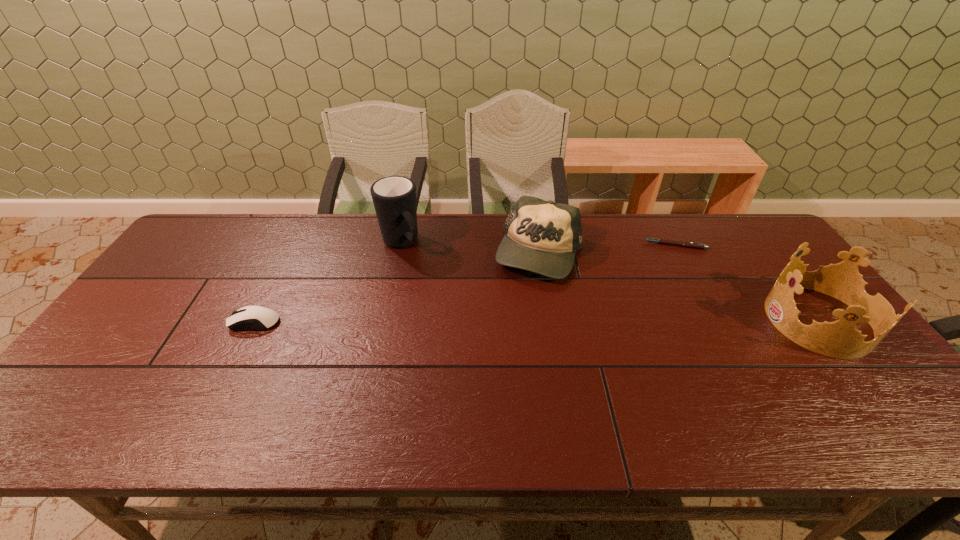
In order to click on free space located 0.300m on the front-facing side of the rightmost object in this screenshot , I will do `click(658, 320)`.

You are a GUI agent. You are given a task and a screenshot of the screen. Output one action in this format:
    pyautogui.click(x=<x>, y=<y>)
    Task: Click on the vacant region located 0.080m on the front-facing side of the rightmost object
    The image size is (960, 540).
    Given the screenshot: What is the action you would take?
    pyautogui.click(x=740, y=320)

Where is `free space located at the nib of the fourth object from left to right`? The height and width of the screenshot is (540, 960). free space located at the nib of the fourth object from left to right is located at coordinates (607, 290).

The width and height of the screenshot is (960, 540). Find the location of `free space located at the nib of the fourth object from left to right`. free space located at the nib of the fourth object from left to right is located at coordinates (631, 269).

Where is `free space located 0.280m at the nib of the fourth object from left to right`? This screenshot has width=960, height=540. free space located 0.280m at the nib of the fourth object from left to right is located at coordinates (605, 292).

The width and height of the screenshot is (960, 540). I want to click on vacant region located 0.150m on the front-facing side of the baseball cap, so click(498, 315).

At what (x,y) coordinates should I click in order to perform the action: click on vacant position located 0.230m on the front-facing side of the baseball cap. Please return your answer as a coordinate pair (x, y). Looking at the image, I should click on tap(484, 334).

Locate an element on the screen. vacant space located 0.080m on the front-facing side of the baseball cap is located at coordinates (509, 299).

Where is `free location located 0.180m on the side of the fourth object from right to left with the handle`? free location located 0.180m on the side of the fourth object from right to left with the handle is located at coordinates (441, 290).

I want to click on free region located on the side of the fourth object from right to left with the handle, so click(479, 334).